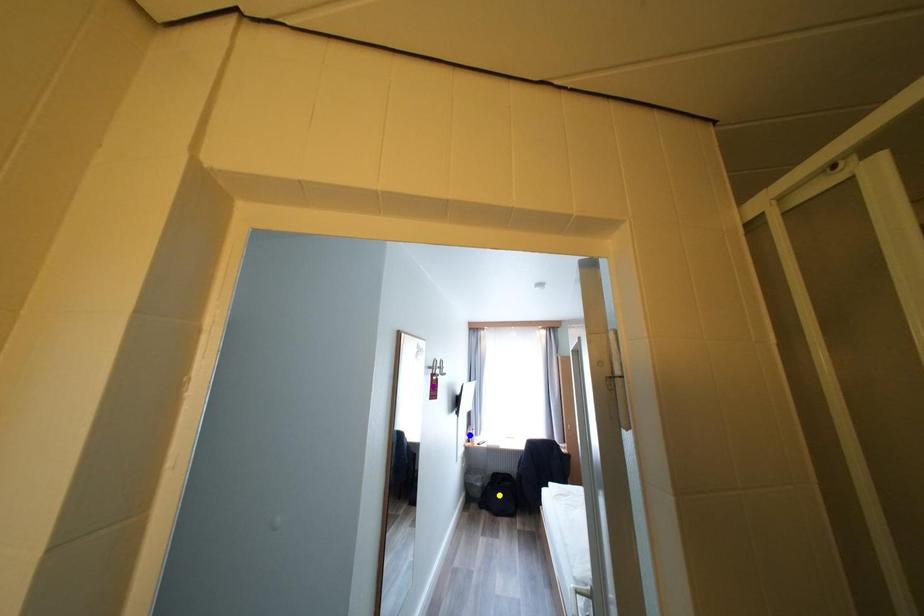
Order these from nearest to farthest:
blue point | purple point | yellow point

yellow point < blue point < purple point